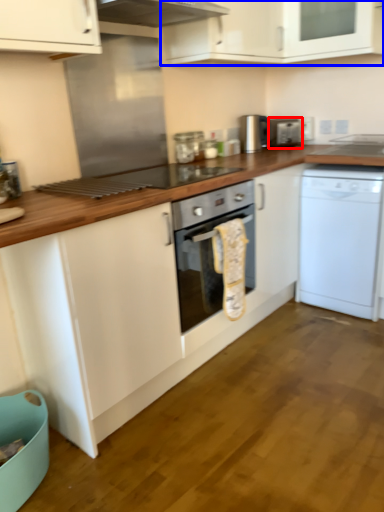
Question: Which object is closer to the camera taking this photo, appliance (highlighted by a red box) or cabinetry (highlighted by a blue box)?

Choices:
 (A) appliance
 (B) cabinetry

Answer: (B)